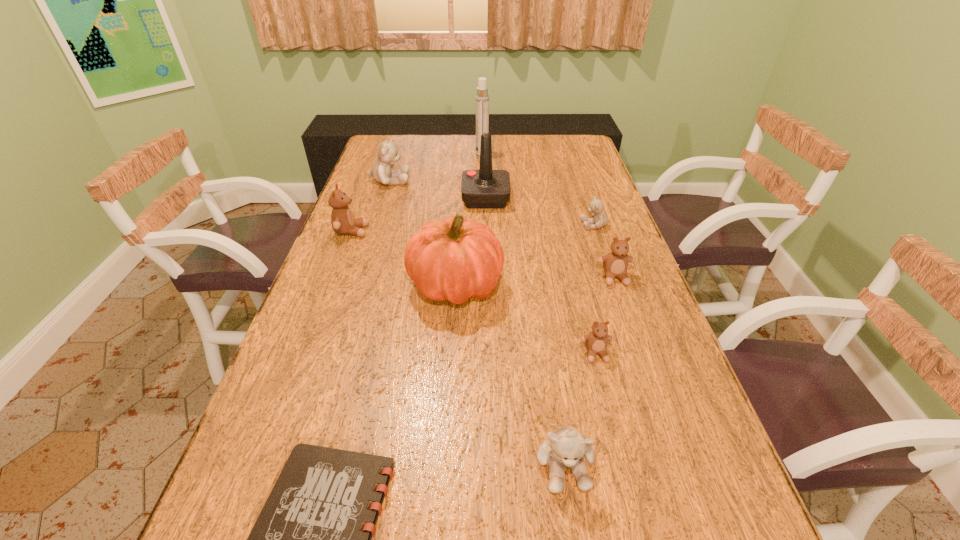
Locate an element on the screen. The image size is (960, 540). the fourth object from right to left is located at coordinates (566, 446).

The height and width of the screenshot is (540, 960). I want to click on the nearest teddy bear, so click(x=566, y=446).

Image resolution: width=960 pixels, height=540 pixels. What are the coordinates of `the third object from right to left` in the screenshot? It's located at (596, 341).

Locate an element on the screen. The image size is (960, 540). the fifth farthest teddy bear is located at coordinates (596, 341).

You are a GUI agent. You are given a task and a screenshot of the screen. Output one action in this format:
    pyautogui.click(x=<x>, y=<y>)
    Task: Click on the second nearest gray teddy bear
    This screenshot has height=540, width=960.
    Given the screenshot: What is the action you would take?
    pyautogui.click(x=596, y=207)

Where is `the smallest gray teddy bear`? This screenshot has height=540, width=960. the smallest gray teddy bear is located at coordinates (596, 207).

This screenshot has height=540, width=960. What are the coordinates of `free space located on the front of the farthest object` in the screenshot? It's located at (482, 176).

In order to click on free space located 0.360m on the back of the joystick in this screenshot , I will do `click(485, 143)`.

Locate an element on the screen. This screenshot has width=960, height=540. vacant space located 0.090m on the back of the orange pumpkin is located at coordinates (459, 237).

Where is `blank space located on the front-facing side of the farthest brown teddy bear`? blank space located on the front-facing side of the farthest brown teddy bear is located at coordinates (441, 231).